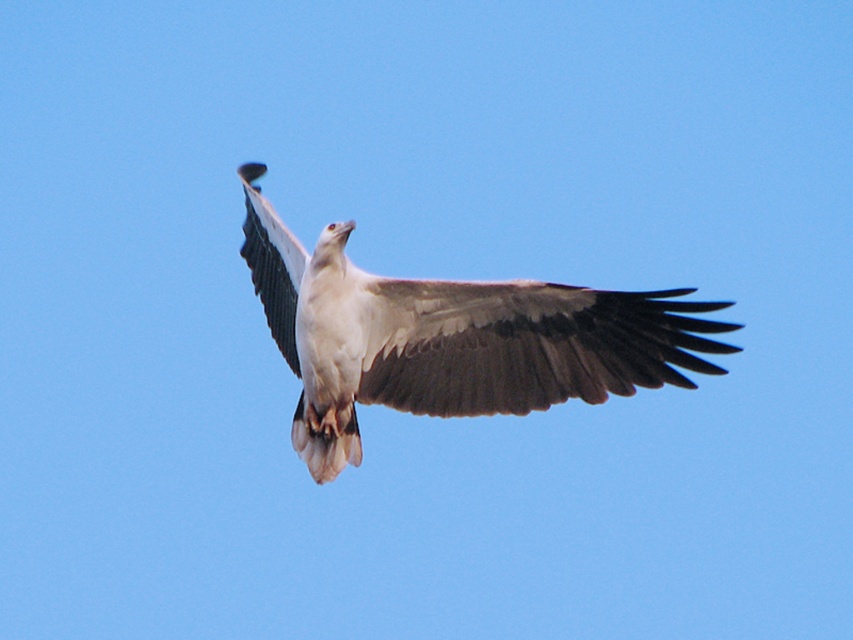
You are a birdwatcher observing a large raptor in flight. You notice two wings at the center of the image. Which wing, the brown feathered wing at center or the white feathered wing at center, is smaller in size?

The brown feathered wing at center is smaller in size compared to the white feathered wing at center according to the description.

You are a drone pilot trying to capture the bird in flight. You notice two points in the sky where the bird might fly next. The first point is at coordinates point (x=294, y=424), and the second is at point (x=436, y=298). From your current position, which point is farther away from you?

Point (x=294, y=424) is behind point (x=436, y=298), so it is farther away from your current position.

You are observing a bird in flight and notice two points on its wings. The first point is at coordinates point (447, 307) and the second is at point (254, 276). Which of these points is closer to you?

Point (447, 307) is closer to the viewer than point (254, 276).